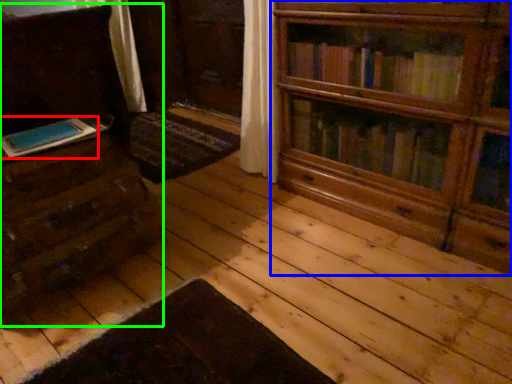
Question: Considering the real-world distances, which object is farthest from book (highlighted by a red box)? bookcase (highlighted by a blue box) or chest of drawers (highlighted by a green box)?

Choices:
 (A) bookcase
 (B) chest of drawers

Answer: (A)